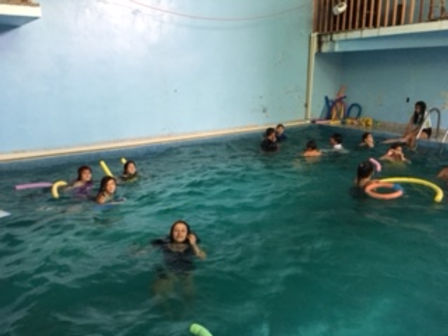
Identify the location of baseboard. (124, 142).